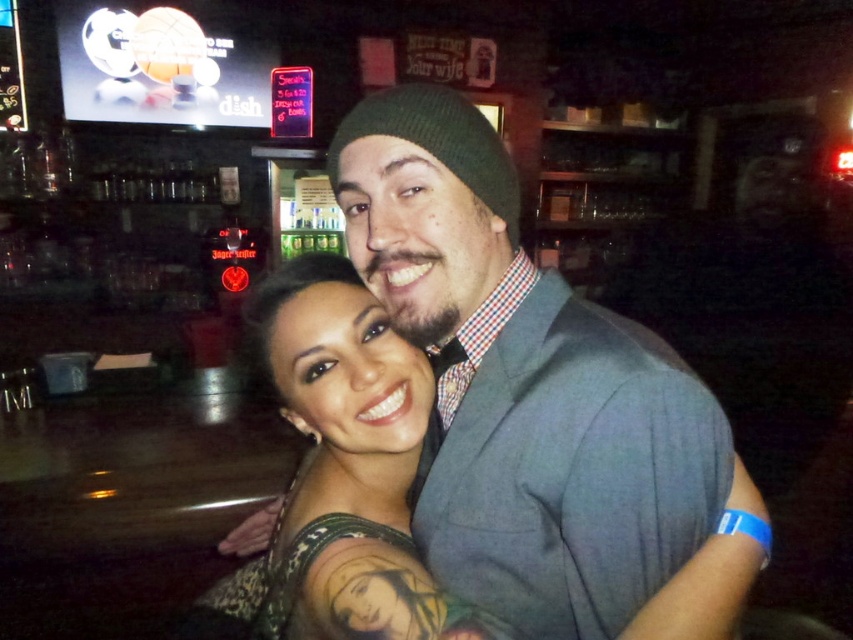
Question: Does matte gray suit at center have a larger size compared to dark skin tattoo at center?

Choices:
 (A) yes
 (B) no

Answer: (A)

Question: Which point is farther to the camera?

Choices:
 (A) (318, 531)
 (B) (496, 492)

Answer: (A)

Question: Is matte gray suit at center to the left of dark skin tattoo at center from the viewer's perspective?

Choices:
 (A) yes
 (B) no

Answer: (B)

Question: Does matte gray suit at center have a smaller size compared to dark skin tattoo at center?

Choices:
 (A) yes
 (B) no

Answer: (B)

Question: Which point is closer to the camera taking this photo?

Choices:
 (A) (381, 253)
 (B) (424, 577)

Answer: (A)

Question: Which object is farther from the camera taking this photo?

Choices:
 (A) dark skin tattoo at center
 (B) matte gray suit at center

Answer: (A)